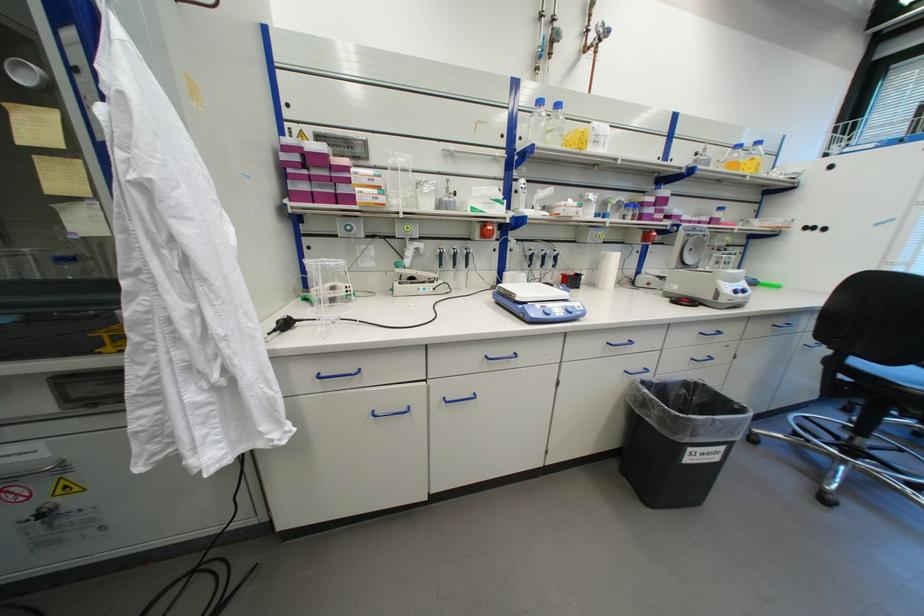
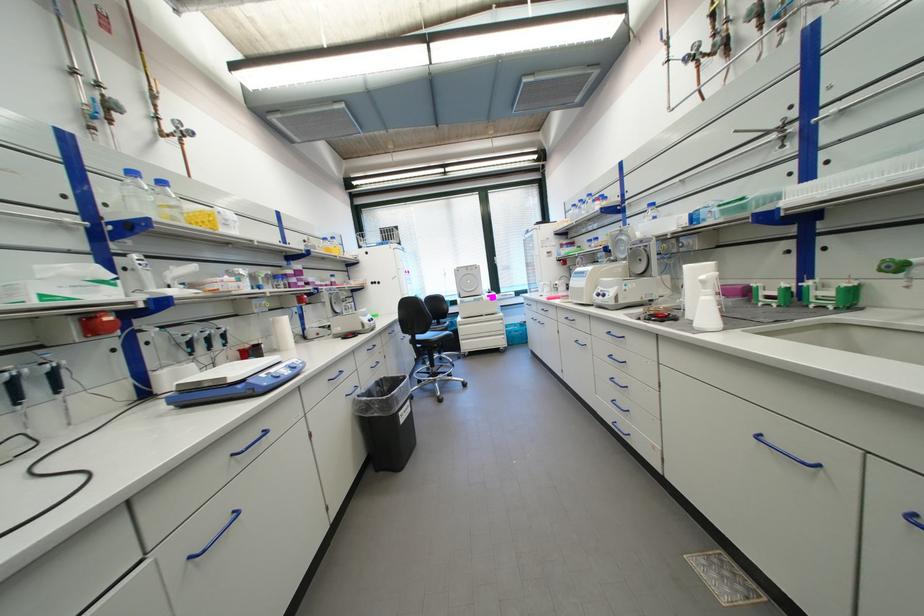
Question: Based on the continuous images, in which direction is the camera rotating? Reply with the corresponding letter.

Choices:
 (A) Left
 (B) Right
 (C) Up
 (D) Down

Answer: (B)